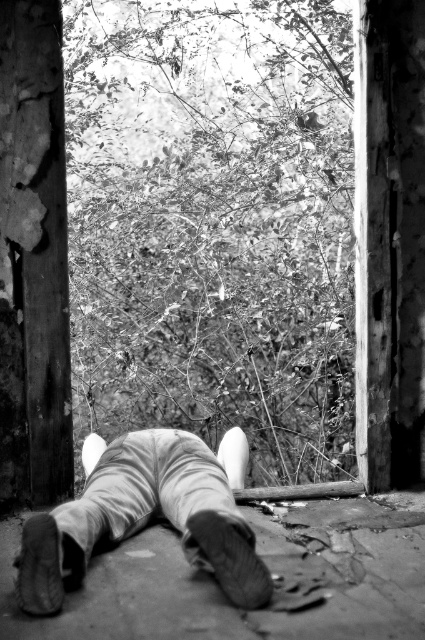
You are an interior designer assessing the space. You need to place a decorative item between the rusty metal pillar at left and the leather shoes at lower center. Considering their widths, which object should the item be placed closer to?

The decorative item should be placed closer to the leather shoes at lower center because the rusty metal pillar at left has a lesser width, meaning the shoes are wider and thus the space between them and the pillar allows for placement nearer to the wider object.

You are standing in the doorway of the abandoned building and notice the rusty metal pillar at left and the leather shoes at lower center. From your vantage point, which object is positioned higher relative to the other?

The rusty metal pillar at left is located above the leather shoes at lower center, so it is positioned higher than the shoes.